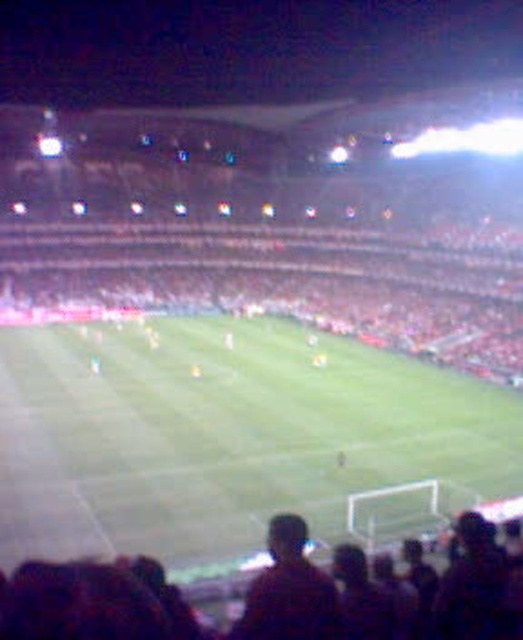
In the scene shown: Who is taller, green grass football field at center or dark brown hair at lower center?

green grass football field at center

How far apart are green grass football field at center and dark brown hair at lower center?

green grass football field at center is 16.88 meters away from dark brown hair at lower center.

Which is behind, point (62, 454) or point (123, 611)?

The point (62, 454) is more distant.

Locate an element on the screen. green grass football field at center is located at coordinates (225, 435).

Is point (328, 456) closer to camera compared to point (255, 618)?

No, (328, 456) is further to viewer.

Is green grass football field at center above dark brown hair at center?

Correct, green grass football field at center is located above dark brown hair at center.

In order to click on green grass football field at center in this screenshot , I will do (x=225, y=435).

Is point (514, 586) behind point (324, 604)?

Yes, point (514, 586) is behind point (324, 604).

This screenshot has width=523, height=640. What do you see at coordinates (185, 602) in the screenshot? I see `dark brown hair at lower center` at bounding box center [185, 602].

Which is in front, point (344, 563) or point (283, 621)?

Point (283, 621) is more forward.

Locate an element on the screen. Image resolution: width=523 pixels, height=640 pixels. dark brown hair at lower center is located at coordinates (185, 602).